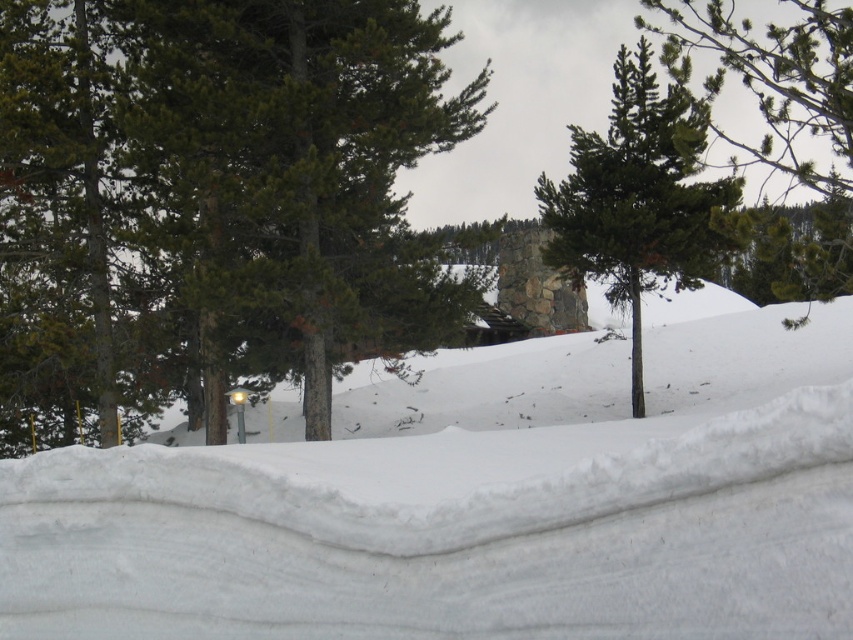
You are standing in the snowy landscape and want to take a photo of the white snow at center and the green matte tree at center. Which object will appear larger in the photo?

The green matte tree at center will appear larger in the photo because it is larger than the white snow at center.

You are standing at the point with coordinates point (166,40) and want to walk towards the point with coordinates point (660,595). Which direction should you move to get closer to your destination?

You should move towards the point (660,595) because it is in front of point (166,40), so moving forward in that direction will bring you closer.